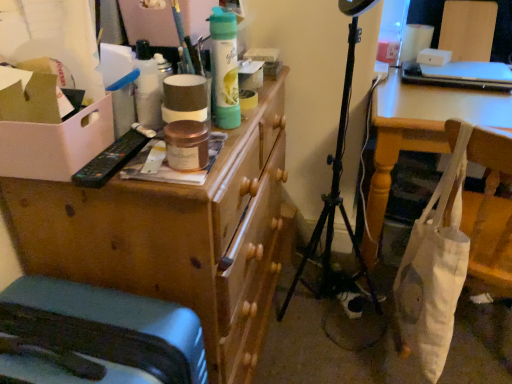
Question: From a real-world perspective, is matte gray suitcase at lower left positioned over wooden chest of drawers at upper left based on gravity?

Choices:
 (A) no
 (B) yes

Answer: (B)

Question: From a real-world perspective, is matte gray suitcase at lower left physically below wooden chest of drawers at upper left?

Choices:
 (A) yes
 (B) no

Answer: (B)

Question: Does matte gray suitcase at lower left have a smaller size compared to wooden chest of drawers at upper left?

Choices:
 (A) yes
 (B) no

Answer: (A)

Question: Can you confirm if matte gray suitcase at lower left is bigger than wooden chest of drawers at upper left?

Choices:
 (A) no
 (B) yes

Answer: (A)

Question: Is matte gray suitcase at lower left not near wooden chest of drawers at upper left?

Choices:
 (A) yes
 (B) no

Answer: (B)

Question: Is matte gray suitcase at lower left spatially inside white canvas tote at lower right, or outside of it?

Choices:
 (A) inside
 (B) outside

Answer: (B)

Question: From a real-world perspective, relative to white canvas tote at lower right, is matte gray suitcase at lower left vertically above or below?

Choices:
 (A) above
 (B) below

Answer: (B)

Question: Does point (31, 359) appear closer or farther from the camera than point (398, 307)?

Choices:
 (A) closer
 (B) farther

Answer: (A)

Question: Considering the positions of matte gray suitcase at lower left and white canvas tote at lower right in the image, is matte gray suitcase at lower left wider or thinner than white canvas tote at lower right?

Choices:
 (A) thin
 (B) wide

Answer: (B)

Question: Is white canvas tote at lower right bigger or smaller than matte gray suitcase at lower left?

Choices:
 (A) big
 (B) small

Answer: (B)

Question: Is white canvas tote at lower right inside the boundaries of matte gray suitcase at lower left, or outside?

Choices:
 (A) outside
 (B) inside

Answer: (A)

Question: Relative to matte gray suitcase at lower left, is white canvas tote at lower right in front or behind?

Choices:
 (A) front
 (B) behind

Answer: (B)

Question: From their relative heights in the image, would you say white canvas tote at lower right is taller or shorter than matte gray suitcase at lower left?

Choices:
 (A) tall
 (B) short

Answer: (A)

Question: Considering the positions of white cardboard box at left and white canvas tote at lower right in the image, is white cardboard box at left bigger or smaller than white canvas tote at lower right?

Choices:
 (A) small
 (B) big

Answer: (A)

Question: Choose the correct answer: Is white cardboard box at left inside white canvas tote at lower right or outside it?

Choices:
 (A) outside
 (B) inside

Answer: (A)